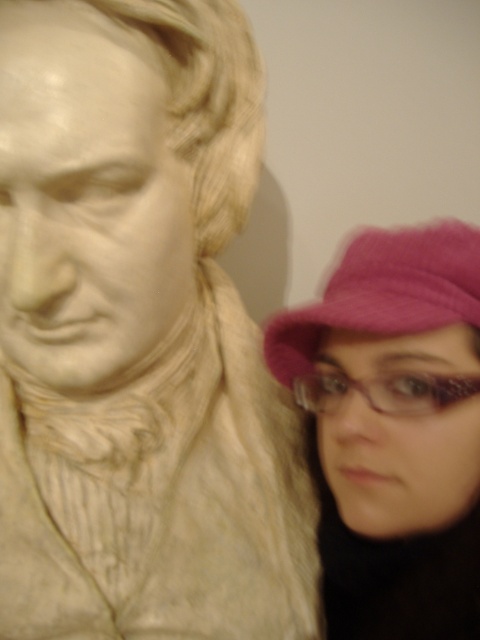
Who is lower down, white marble bust at upper left or pink fuzzy hat at right?

Positioned lower is pink fuzzy hat at right.

Between point (121, 230) and point (468, 273), which one is positioned behind?

The point (121, 230) is behind.

Does point (39, 180) come behind point (412, 634)?

No, (39, 180) is in front of (412, 634).

You are a GUI agent. You are given a task and a screenshot of the screen. Output one action in this format:
    pyautogui.click(x=<x>, y=<y>)
    Task: Click on the white marble bust at upper left
    
    Given the screenshot: What is the action you would take?
    pyautogui.click(x=112, y=177)

Between white marble bust at upper left and pink fuzzy hat at lower right, which one appears on the left side from the viewer's perspective?

white marble bust at upper left is more to the left.

Looking at this image, does white marble bust at upper left have a greater height compared to pink fuzzy hat at lower right?

Indeed, white marble bust at upper left has a greater height compared to pink fuzzy hat at lower right.

Between point (110, 128) and point (472, 300), which one is positioned behind?

The point (472, 300) is more distant.

Locate an element on the screen. This screenshot has height=640, width=480. white marble bust at upper left is located at coordinates (112, 177).

Measure the distance between point [433,268] and camera.

The distance of point [433,268] from camera is 24.27 inches.

Who is positioned more to the left, pink fuzzy hat at right or pink fuzzy hat at lower right?

Positioned to the left is pink fuzzy hat at lower right.

Image resolution: width=480 pixels, height=640 pixels. Identify the location of pink fuzzy hat at right. (394, 429).